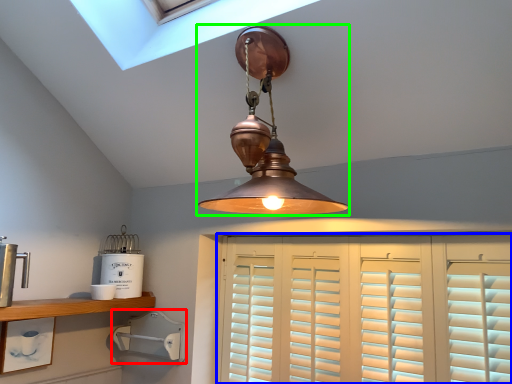
Question: Estimate the real-world distances between objects in this image. Which object is farther from appliance (highlighted by a red box), cabinetry (highlighted by a blue box) or lamp (highlighted by a green box)?

Choices:
 (A) cabinetry
 (B) lamp

Answer: (B)